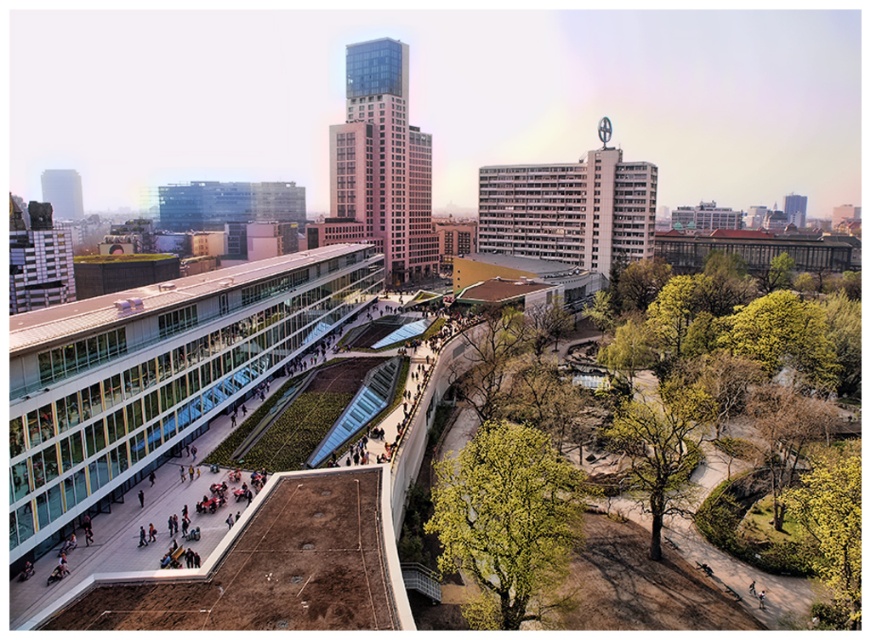
Does green leafy tree at center have a lesser height compared to green leafy tree at lower right?

No, green leafy tree at center is not shorter than green leafy tree at lower right.

Which is behind, point (485, 538) or point (647, 410)?

Positioned behind is point (647, 410).

Image resolution: width=871 pixels, height=640 pixels. Describe the element at coordinates (505, 518) in the screenshot. I see `green leafy tree at center` at that location.

You are a GUI agent. You are given a task and a screenshot of the screen. Output one action in this format:
    pyautogui.click(x=<x>, y=<y>)
    Task: Click on the green leafy tree at center
    Image resolution: width=871 pixels, height=640 pixels.
    Given the screenshot: What is the action you would take?
    pyautogui.click(x=505, y=518)

Is point (655, 490) positioned in front of point (829, 502)?

That is False.

Does green leafy tree at lower right appear over yellow-green leafy tree at lower right?

Correct, green leafy tree at lower right is located above yellow-green leafy tree at lower right.

Locate an element on the screen. green leafy tree at lower right is located at coordinates [660, 448].

Who is positioned more to the left, green leafy tree at center or yellow-green leafy tree at lower right?

green leafy tree at center

Is green leafy tree at center closer to the viewer compared to yellow-green leafy tree at lower right?

Yes.

Locate an element on the screen. green leafy tree at center is located at coordinates (505, 518).

What are the coordinates of `green leafy tree at center` in the screenshot? It's located at (505, 518).